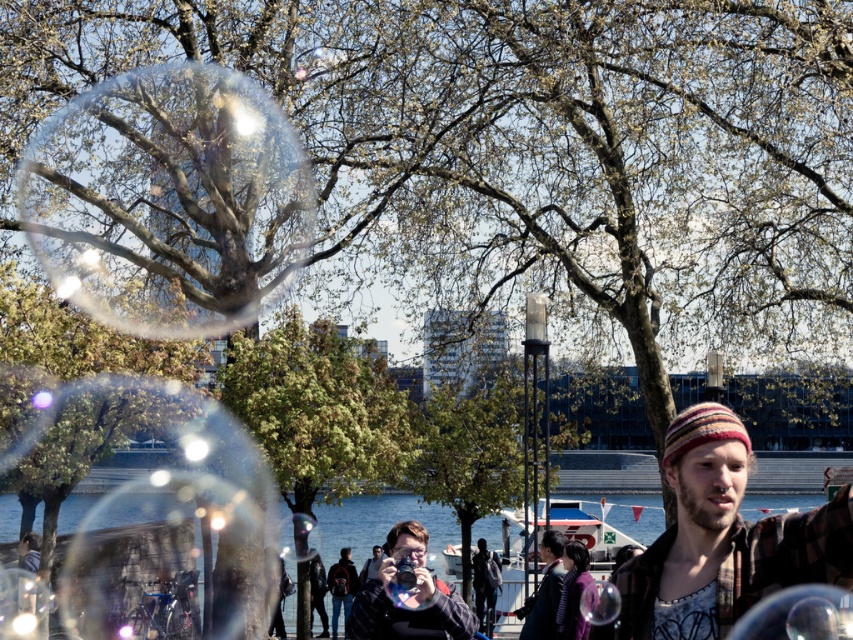
Question: Does transparent glass bubble at upper left appear over matte black camera at center?

Choices:
 (A) yes
 (B) no

Answer: (A)

Question: Estimate the real-world distances between objects in this image. Which object is farther from the plaid flannel shirt at right?

Choices:
 (A) matte black camera at center
 (B) transparent glass bubble at upper left

Answer: (B)

Question: Which of the following is the farthest from the observer?

Choices:
 (A) matte black camera at center
 (B) plaid flannel shirt at right
 (C) transparent glass bubble at upper left

Answer: (C)

Question: Is plaid flannel shirt at right in front of matte black camera at center?

Choices:
 (A) no
 (B) yes

Answer: (B)

Question: Which point is farther from the camera taking this photo?

Choices:
 (A) (834, 500)
 (B) (189, 214)

Answer: (B)

Question: Can you confirm if plaid flannel shirt at right is positioned to the right of matte black camera at center?

Choices:
 (A) no
 (B) yes

Answer: (B)